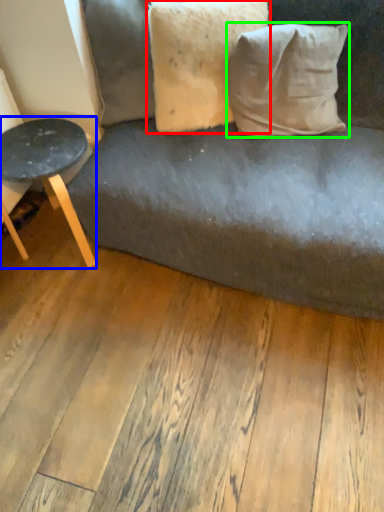
Question: Based on their relative distances, which object is farther from pillow (highlighted by a red box)? Choose from table (highlighted by a blue box) and pillow (highlighted by a green box).

Choices:
 (A) table
 (B) pillow

Answer: (A)